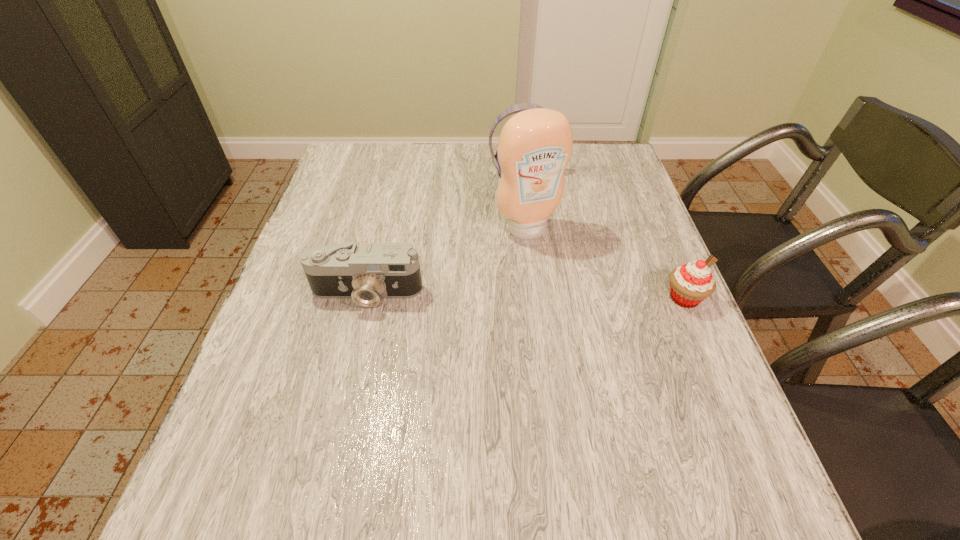
In the image, there is a desktop. Where is `vacant space at the right edge`? This screenshot has width=960, height=540. vacant space at the right edge is located at coordinates (639, 251).

Find the location of a particular element. The image size is (960, 540). blank space at the near left corner of the desktop is located at coordinates (303, 433).

In order to click on free space at the near right corner of the desktop in this screenshot , I will do `click(709, 423)`.

Locate an element on the screen. The width and height of the screenshot is (960, 540). vacant space that's between the leftmost object and the headset is located at coordinates (444, 233).

Where is `vacant space that's between the cupcake and the headset`? This screenshot has width=960, height=540. vacant space that's between the cupcake and the headset is located at coordinates (603, 236).

The image size is (960, 540). I want to click on empty space between the third nearest object and the leftmost object, so click(x=447, y=261).

Locate an element on the screen. This screenshot has height=540, width=960. empty location between the leftmost object and the second farthest object is located at coordinates 447,261.

Identify the location of vacant area between the second tallest object and the leftmost object. (444, 233).

I want to click on empty space between the cupcake and the third nearest object, so click(606, 264).

Image resolution: width=960 pixels, height=540 pixels. Identify the location of free point between the cupcake and the leftmost object. (525, 295).